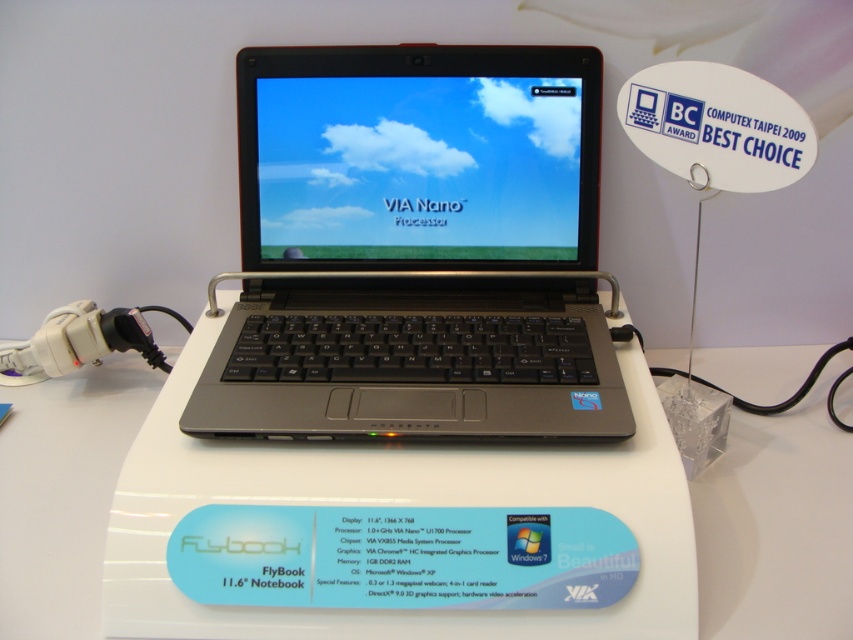
You are setting up a display for a tech event and need to place a small decorative item between the satin black laptop at center and the white plastic table at center. Considering their heights, which object should the item be placed closer to in order to ensure stability?

The satin black laptop at center is taller than the white plastic table at center. To ensure stability, the decorative item should be placed closer to the satin black laptop at center since it has a greater height and can provide a more stable base.